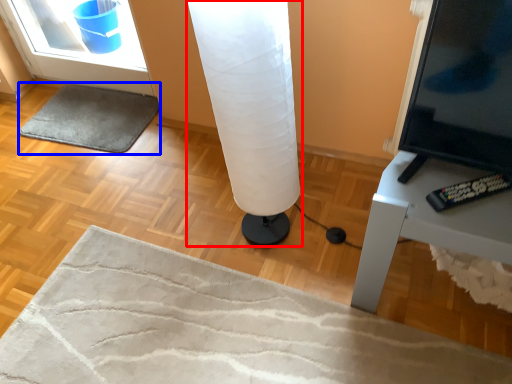
Question: Which point is closer to the camera, lamp (highlighted by a red box) or yoga mat (highlighted by a blue box)?

Choices:
 (A) lamp
 (B) yoga mat

Answer: (A)